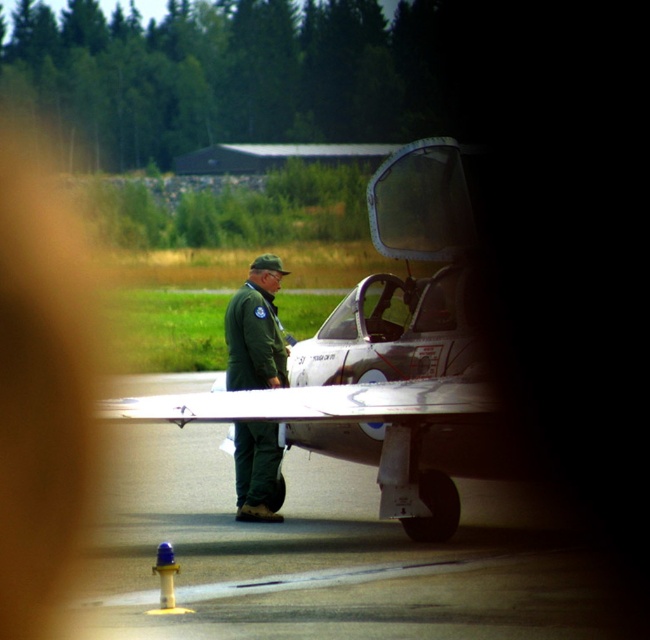
Does smooth asphalt tarmac at center come in front of green matte uniform at center?

Yes.

Which is in front, point (228, 584) or point (270, 284)?

Positioned in front is point (228, 584).

Identify the location of smooth asphalt tarmac at center. (335, 556).

Does silver metallic jet at center appear on the right side of green matte uniform at center?

Yes, silver metallic jet at center is to the right of green matte uniform at center.

Can you confirm if silver metallic jet at center is taller than green matte uniform at center?

Indeed, silver metallic jet at center has a greater height compared to green matte uniform at center.

Who is more distant from viewer, (398,337) or (239,323)?

Positioned behind is point (239,323).

Where is `silver metallic jet at center`? silver metallic jet at center is located at coordinates (387, 356).

From the picture: Who is lower down, smooth asphalt tarmac at center or silver metallic jet at center?

Positioned lower is smooth asphalt tarmac at center.

Can you confirm if smooth asphalt tarmac at center is positioned above silver metallic jet at center?

No.

Where is `smooth asphalt tarmac at center`? smooth asphalt tarmac at center is located at coordinates (335, 556).